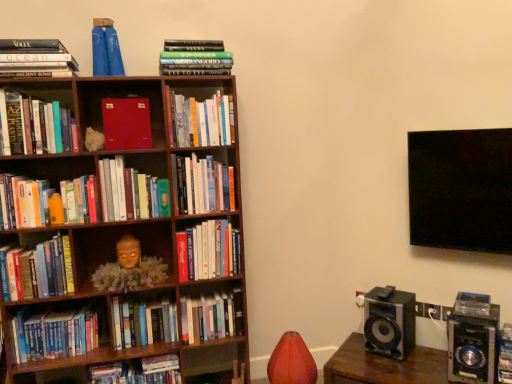
Question: Should I look upward or downward to see matte gold mask at center-left?

Choices:
 (A) up
 (B) down

Answer: (B)

Question: Can you confirm if velvet red bean bag chair at lower center is wider than hardcover book at upper left, the second book when ordered from left to right?

Choices:
 (A) no
 (B) yes

Answer: (A)

Question: Is velvet red bean bag chair at lower center outside hardcover book at upper left, the second book when ordered from left to right?

Choices:
 (A) yes
 (B) no

Answer: (A)

Question: From a real-world perspective, is velvet red bean bag chair at lower center located higher than hardcover book at upper left, the second book when ordered from left to right?

Choices:
 (A) no
 (B) yes

Answer: (A)

Question: Considering the relative sizes of velvet red bean bag chair at lower center and hardcover book at upper left, the second book when ordered from left to right, in the image provided, is velvet red bean bag chair at lower center shorter than hardcover book at upper left, the second book when ordered from left to right,?

Choices:
 (A) yes
 (B) no

Answer: (B)

Question: Does velvet red bean bag chair at lower center appear on the left side of hardcover book at upper left, which is the 14th book in right-to-left order?

Choices:
 (A) yes
 (B) no

Answer: (B)

Question: Can you confirm if velvet red bean bag chair at lower center is positioned to the right of hardcover book at upper left, the second book when ordered from left to right?

Choices:
 (A) no
 (B) yes

Answer: (B)

Question: Can you confirm if green matte book at center, which ranks as the 8th book in left-to-right order, is shorter than matte red book at center-left, acting as the sixth book starting from the left?

Choices:
 (A) no
 (B) yes

Answer: (A)

Question: From the image's perspective, does green matte book at center, which ranks as the 8th book in left-to-right order, appear lower than matte red book at center-left, the 10th book in the right-to-left sequence?

Choices:
 (A) yes
 (B) no

Answer: (A)

Question: From a real-world perspective, does green matte book at center, which ranks as the 8th book in left-to-right order, stand above matte red book at center-left, acting as the sixth book starting from the left?

Choices:
 (A) yes
 (B) no

Answer: (B)

Question: Is green matte book at center, which ranks as the 8th book in left-to-right order, at the left side of matte red book at center-left, the 10th book in the right-to-left sequence?

Choices:
 (A) no
 (B) yes

Answer: (A)

Question: Is green matte book at center, which ranks as the 8th book in right-to-left order, in front of matte red book at center-left, acting as the sixth book starting from the left?

Choices:
 (A) no
 (B) yes

Answer: (B)

Question: Is green matte book at center, which ranks as the 8th book in left-to-right order, thinner than matte red book at center-left, acting as the sixth book starting from the left?

Choices:
 (A) no
 (B) yes

Answer: (A)

Question: Is wooden speaker at lower right positioned beyond the bounds of green matte book at center, which ranks as the 8th book in right-to-left order?

Choices:
 (A) yes
 (B) no

Answer: (A)